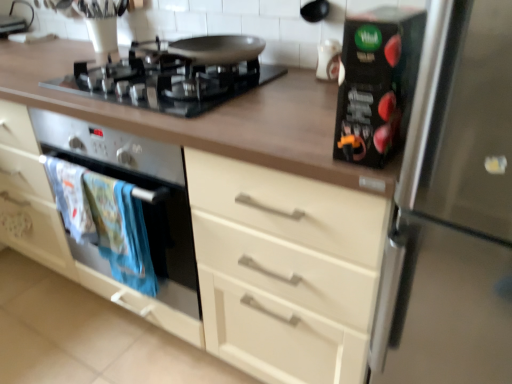
Question: From the image's perspective, would you say black glass gas stove at upper center is shown under white fabric towels at lower left?

Choices:
 (A) no
 (B) yes

Answer: (A)

Question: Is the depth of black glass gas stove at upper center greater than that of white fabric towels at lower left?

Choices:
 (A) yes
 (B) no

Answer: (B)

Question: Considering the relative sizes of black glass gas stove at upper center and white fabric towels at lower left in the image provided, is black glass gas stove at upper center shorter than white fabric towels at lower left?

Choices:
 (A) yes
 (B) no

Answer: (A)

Question: Is black glass gas stove at upper center facing away from white fabric towels at lower left?

Choices:
 (A) yes
 (B) no

Answer: (B)

Question: From a real-world perspective, is black glass gas stove at upper center below white fabric towels at lower left?

Choices:
 (A) no
 (B) yes

Answer: (A)

Question: Is black glass gas stove at upper center directly adjacent to white fabric towels at lower left?

Choices:
 (A) no
 (B) yes

Answer: (A)

Question: Considering the relative sizes of black glass gas stove at upper center and white glossy vase at upper center, marked as the second appliance in a bottom-to-top arrangement, in the image provided, is black glass gas stove at upper center taller than white glossy vase at upper center, marked as the second appliance in a bottom-to-top arrangement,?

Choices:
 (A) no
 (B) yes

Answer: (A)

Question: Is black glass gas stove at upper center not inside white glossy vase at upper center, the first appliance when ordered from top to bottom?

Choices:
 (A) yes
 (B) no

Answer: (A)

Question: Is black glass gas stove at upper center at the left side of white glossy vase at upper center, the first appliance when ordered from top to bottom?

Choices:
 (A) yes
 (B) no

Answer: (A)

Question: Is black glass gas stove at upper center in contact with white glossy vase at upper center, the first appliance when ordered from top to bottom?

Choices:
 (A) no
 (B) yes

Answer: (A)

Question: Is the position of black glass gas stove at upper center less distant than that of white glossy vase at upper center, the first appliance when ordered from top to bottom?

Choices:
 (A) yes
 (B) no

Answer: (A)

Question: Does black glass gas stove at upper center have a smaller size compared to white glossy vase at upper center, the first appliance when ordered from back to front?

Choices:
 (A) yes
 (B) no

Answer: (B)

Question: Does matte black oven at left have a smaller size compared to white fabric towels at lower left?

Choices:
 (A) no
 (B) yes

Answer: (A)